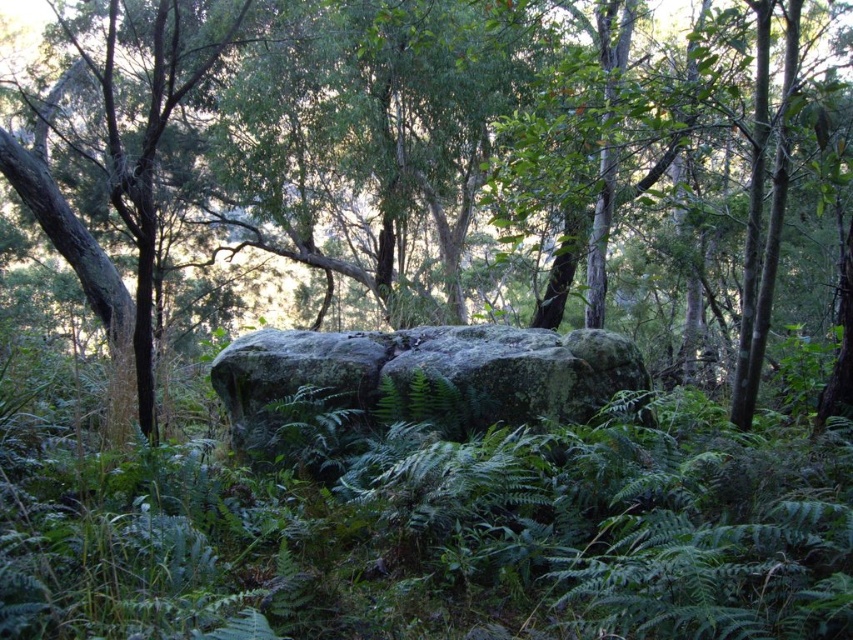
Can you confirm if green mossy rock at center is wider than green mossy boulder at center?

Correct, the width of green mossy rock at center exceeds that of green mossy boulder at center.

Who is lower down, green mossy rock at center or green mossy boulder at center?

green mossy boulder at center is below.

Locate an element on the screen. green mossy rock at center is located at coordinates (660, 144).